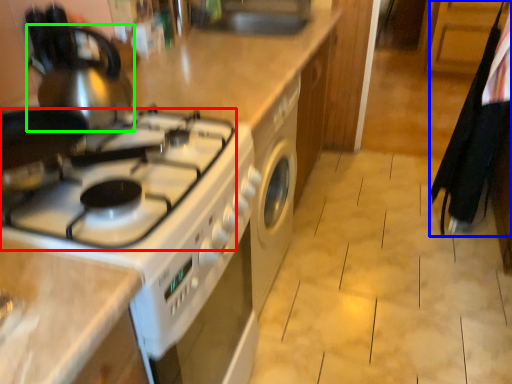
Question: Estimate the real-world distances between objects in this image. Which object is closer to gas stove (highlighted by a red box), laundry (highlighted by a blue box) or tea pot (highlighted by a green box)?

Choices:
 (A) laundry
 (B) tea pot

Answer: (B)